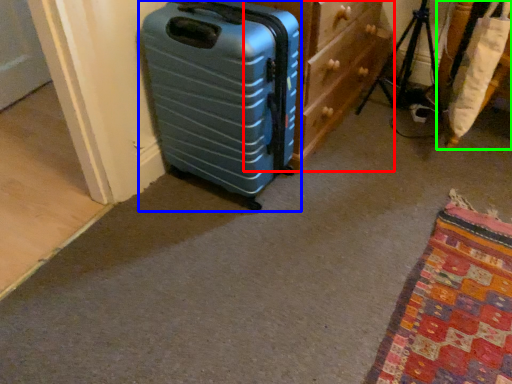
Question: Which is nearer to the dresser (highlighted by a red box)? suitcase (highlighted by a blue box) or furniture (highlighted by a green box).

Choices:
 (A) suitcase
 (B) furniture

Answer: (A)